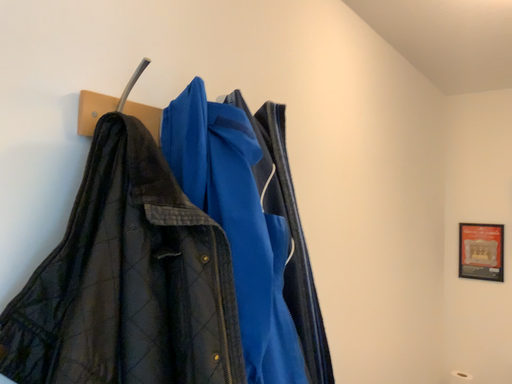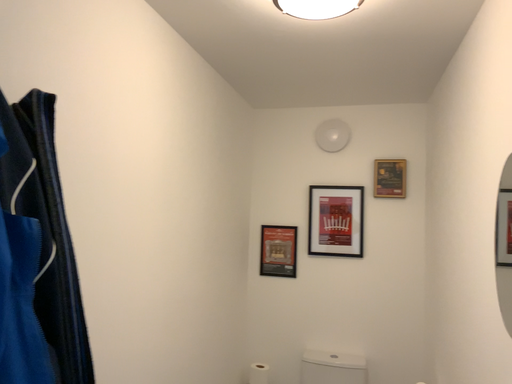
Question: How did the camera likely rotate when shooting the video?

Choices:
 (A) rotated right
 (B) rotated left

Answer: (A)